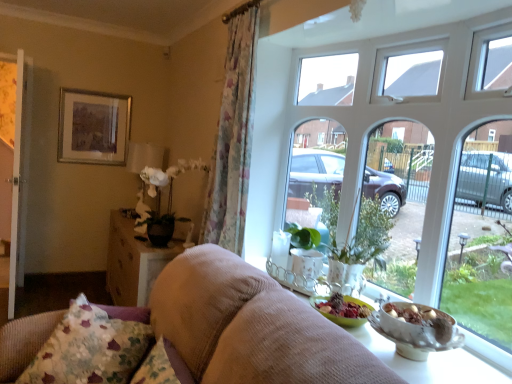
Where is `wooden textured table at lower left`? The height and width of the screenshot is (384, 512). wooden textured table at lower left is located at coordinates (134, 262).

What is the approximate height of fluffy fabric pillow at lower left?

fluffy fabric pillow at lower left is 18.75 inches in height.

What do you see at coordinates (390, 127) in the screenshot? The width and height of the screenshot is (512, 384). I see `white glass window at upper center` at bounding box center [390, 127].

The width and height of the screenshot is (512, 384). I want to click on wooden textured table at lower left, so [134, 262].

Is wooden textured table at lower left oriented away from white matte floral arrangement at center-left?

No, wooden textured table at lower left is not facing the opposite direction of white matte floral arrangement at center-left.

Which is behind, point (155, 253) or point (156, 195)?

The point (156, 195) is behind.

Consider the image. Does wooden textured table at lower left appear on the right side of white matte floral arrangement at center-left?

No, wooden textured table at lower left is not to the right of white matte floral arrangement at center-left.

Between wooden textured table at lower left and white matte floral arrangement at center-left, which one has larger size?

wooden textured table at lower left is bigger.

From a real-world perspective, relative to white wooden screen door at left, is silver metallic picture frame at upper left vertically above or below?

In terms of real-world spatial position, silver metallic picture frame at upper left is above white wooden screen door at left.

Which of these two, silver metallic picture frame at upper left or white wooden screen door at left, is thinner?

silver metallic picture frame at upper left.

Is silver metallic picture frame at upper left aimed at white wooden screen door at left?

No.

Considering the positions of objects white matte floral arrangement at center-left and silver metallic picture frame at upper left in the image provided, who is more to the right, white matte floral arrangement at center-left or silver metallic picture frame at upper left?

white matte floral arrangement at center-left.

From their relative heights in the image, would you say white matte floral arrangement at center-left is taller or shorter than silver metallic picture frame at upper left?

Considering their sizes, white matte floral arrangement at center-left has less height than silver metallic picture frame at upper left.

Could you measure the distance between white matte floral arrangement at center-left and silver metallic picture frame at upper left?

The distance of white matte floral arrangement at center-left from silver metallic picture frame at upper left is 3.50 feet.

Who is bigger, white matte floral arrangement at center-left or silver metallic picture frame at upper left?

Bigger between the two is white matte floral arrangement at center-left.

From a real-world perspective, relative to green glossy houseplant at center, is fluffy fabric pillow at lower left vertically above or below?

In terms of real-world spatial position, fluffy fabric pillow at lower left is below green glossy houseplant at center.

Are fluffy fabric pillow at lower left and green glossy houseplant at center located far from each other?

fluffy fabric pillow at lower left is far away from green glossy houseplant at center.

Is fluffy fabric pillow at lower left to the right of green glossy houseplant at center from the viewer's perspective?

Incorrect, fluffy fabric pillow at lower left is not on the right side of green glossy houseplant at center.

Identify the location of studio couch lying in front of the fluffy fabric pillow at lower left. The height and width of the screenshot is (384, 512). tap(252, 327).

Is suede-like beige sofa at center oriented towards fluffy fabric pillow at lower left?

Yes, suede-like beige sofa at center is facing fluffy fabric pillow at lower left.

Does suede-like beige sofa at center appear on the right side of fluffy fabric pillow at lower left?

Yes, suede-like beige sofa at center is to the right of fluffy fabric pillow at lower left.

How many degrees apart are the facing directions of suede-like beige sofa at center and fluffy fabric pillow at lower left?

They differ by 55.4 degrees in their facing directions.

Could you tell me if white matte floral arrangement at center-left is facing suede-like beige sofa at center?

No, white matte floral arrangement at center-left does not turn towards suede-like beige sofa at center.

Does point (159, 237) lie behind point (274, 282)?

Yes, point (159, 237) is farther from viewer.

Is there a large distance between floral fabric curtain at left and wooden textured table at lower left?

No.

Does floral fabric curtain at left have a smaller size compared to wooden textured table at lower left?

Yes.

Is point (227, 107) positioned behind point (127, 292)?

No, (227, 107) is in front of (127, 292).

The width and height of the screenshot is (512, 384). I want to click on curtain above the wooden textured table at lower left (from the image's perspective), so click(x=233, y=136).

Locate an element on the screen. Image resolution: width=512 pixels, height=384 pixels. table lying below the white matte floral arrangement at center-left (from the image's perspective) is located at coordinates (134, 262).

This screenshot has width=512, height=384. I want to click on picture frame above the white wooden screen door at left (from a real-world perspective), so click(x=93, y=127).

Which object lies further to the anchor point wooden textured table at lower left, floral fabric curtain at left or fluffy fabric pillow at lower left?

Based on the image, fluffy fabric pillow at lower left appears to be further to wooden textured table at lower left.

From the image, which object appears to be nearer to green glossy houseplant at center, silver metallic picture frame at upper left or suede-like beige sofa at center?

Among the two, suede-like beige sofa at center is located nearer to green glossy houseplant at center.

Considering their positions, is white glass window at upper center positioned closer to fluffy fabric pillow at lower left than white matte floral arrangement at center-left?

white glass window at upper center is closer to fluffy fabric pillow at lower left.

Based on their spatial positions, is white matte floral arrangement at center-left or wooden textured table at lower left further from white wooden screen door at left?

white matte floral arrangement at center-left.

Considering their positions, is floral fabric curtain at left positioned further to silver metallic picture frame at upper left than wooden textured table at lower left?

The object further to silver metallic picture frame at upper left is floral fabric curtain at left.

In the scene shown: Looking at the image, which one is located closer to white wooden screen door at left, suede-like beige sofa at center or fluffy fabric pillow at lower left?

fluffy fabric pillow at lower left lies closer to white wooden screen door at left than the other object.

Considering their positions, is white glass window at upper center positioned closer to silver metallic picture frame at upper left than wooden textured table at lower left?

wooden textured table at lower left is positioned closer to the anchor silver metallic picture frame at upper left.

Estimate the real-world distances between objects in this image. Which object is closer to white matte floral arrangement at center-left, floral fabric curtain at left or fluffy fabric pillow at lower left?

The object closer to white matte floral arrangement at center-left is floral fabric curtain at left.

Locate an element on the screen. picture frame located between white wooden screen door at left and white glass window at upper center in the left-right direction is located at coordinates (93, 127).

The width and height of the screenshot is (512, 384). Identify the location of table located between white wooden screen door at left and floral fabric curtain at left in the left-right direction. (134, 262).

Find the location of a particular element. pillow between white glass window at upper center and silver metallic picture frame at upper left from front to back is located at coordinates (89, 348).

Where is `pillow between white wooden screen door at left and white glass window at upper center from left to right`? Image resolution: width=512 pixels, height=384 pixels. pillow between white wooden screen door at left and white glass window at upper center from left to right is located at coordinates point(89,348).